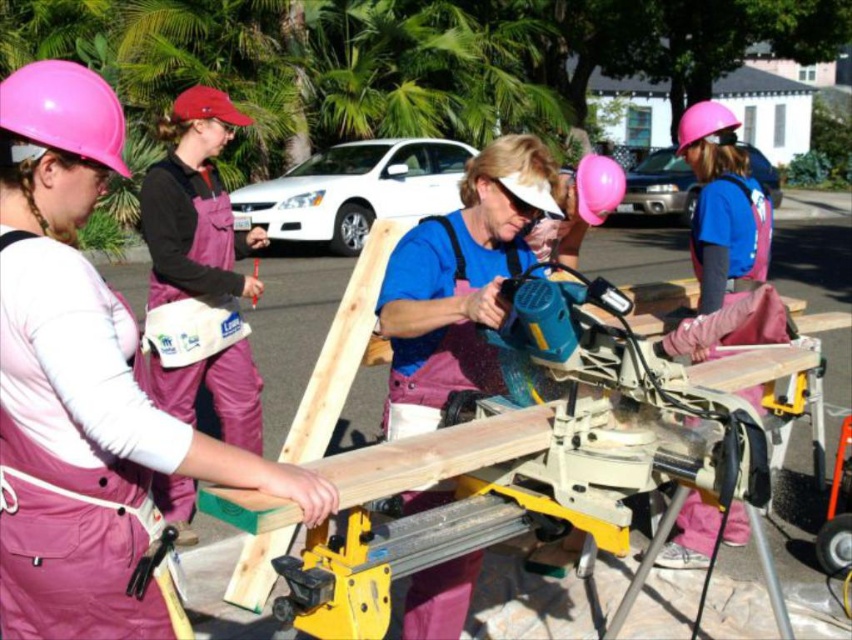
Question: Is pink matte helmet at upper left in front of pink matte helmet at upper center?

Choices:
 (A) no
 (B) yes

Answer: (B)

Question: Which point is farther to the camera?

Choices:
 (A) pink fabric apron at upper left
 (B) pink matte helmet at upper center
 (C) pink matte helmet at upper left
 (D) pink matte balloon at center

Answer: (B)

Question: Is pink fabric apron at upper left positioned before pink matte helmet at upper center?

Choices:
 (A) yes
 (B) no

Answer: (A)

Question: Is pink matte helmet at upper left wider than pink matte helmet at upper center?

Choices:
 (A) yes
 (B) no

Answer: (B)

Question: Which point is closer to the camera?

Choices:
 (A) pink matte helmet at upper center
 (B) pink matte helmet at upper left
 (C) pink matte balloon at center

Answer: (B)

Question: Which point is closer to the camera?

Choices:
 (A) (715, 129)
 (B) (72, 369)
 (C) (56, 124)
 (D) (577, 205)

Answer: (B)